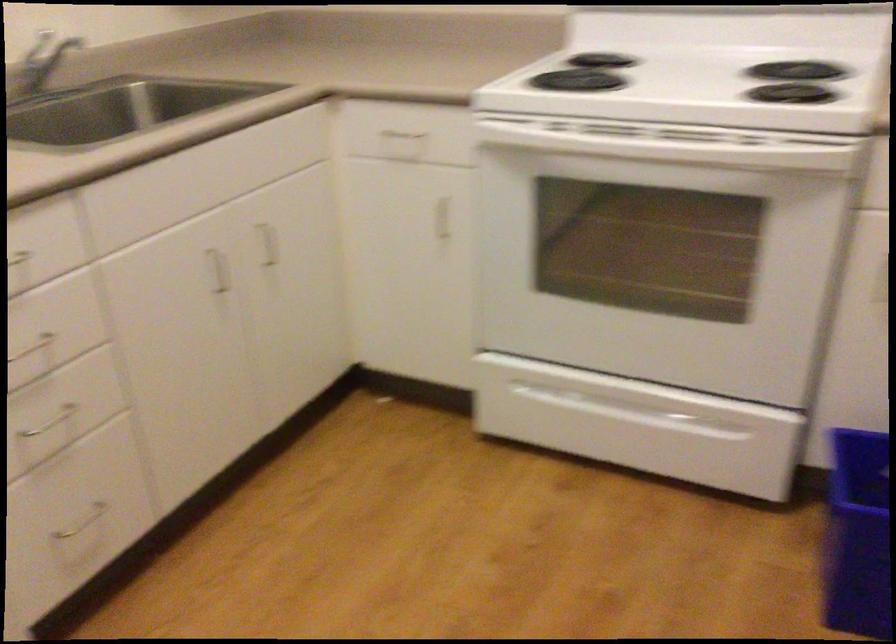
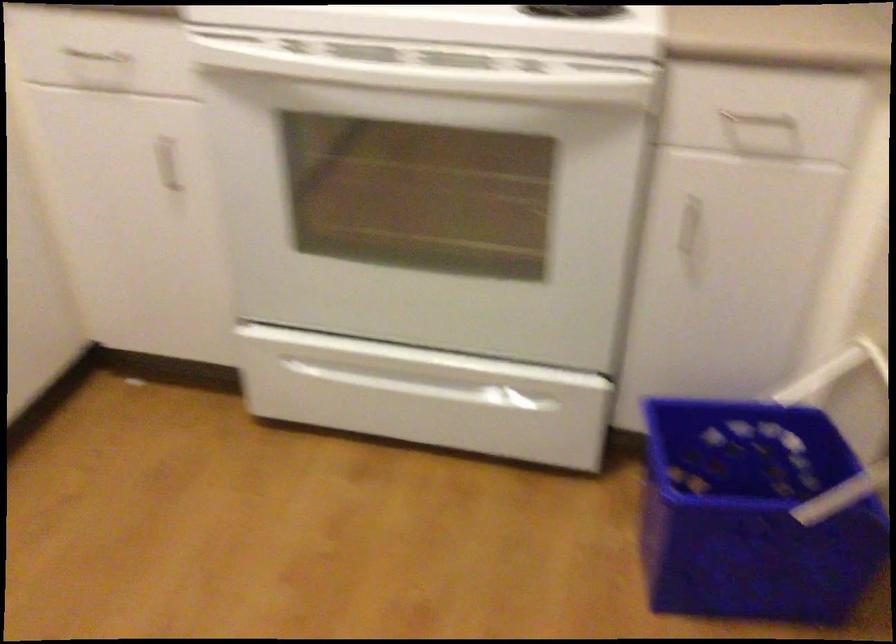
Locate, in the second image, the point that corresponds to point 436,212 in the first image.

(167, 164)